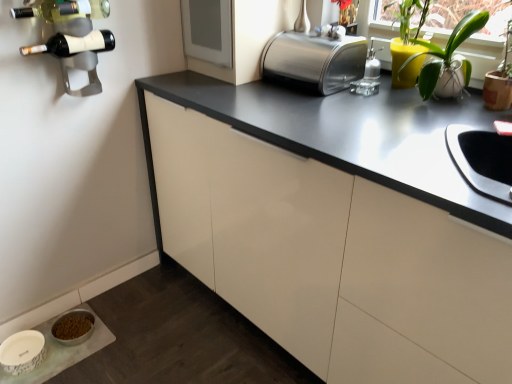
Question: From the image's perspective, is white glossy pet food bowl at lower left positioned above or below matte white cabinet at center?

Choices:
 (A) below
 (B) above

Answer: (A)

Question: Considering their positions, is white glossy pet food bowl at lower left located in front of or behind matte white cabinet at center?

Choices:
 (A) behind
 (B) front

Answer: (A)

Question: Based on their relative distances, which object is farther from the polished stainless steel toaster at upper center?

Choices:
 (A) matte black wine bottle at upper left, positioned as the 2th wine bottle in top-to-bottom order
 (B) metallic wine rack at upper left
 (C) white glossy pet food bowl at lower left
 (D) matte white cabinet at center
 (E) white ceramic pot at upper right

Answer: (C)

Question: Based on their relative distances, which object is nearer to the matte white cabinet at center?

Choices:
 (A) polished stainless steel toaster at upper center
 (B) matte black wine bottle at upper left, positioned as the 2th wine bottle in top-to-bottom order
 (C) green glass wine bottle at upper left, acting as the 1th wine bottle starting from the top
 (D) white glossy pet food bowl at lower left
 (E) white ceramic pot at upper right

Answer: (A)